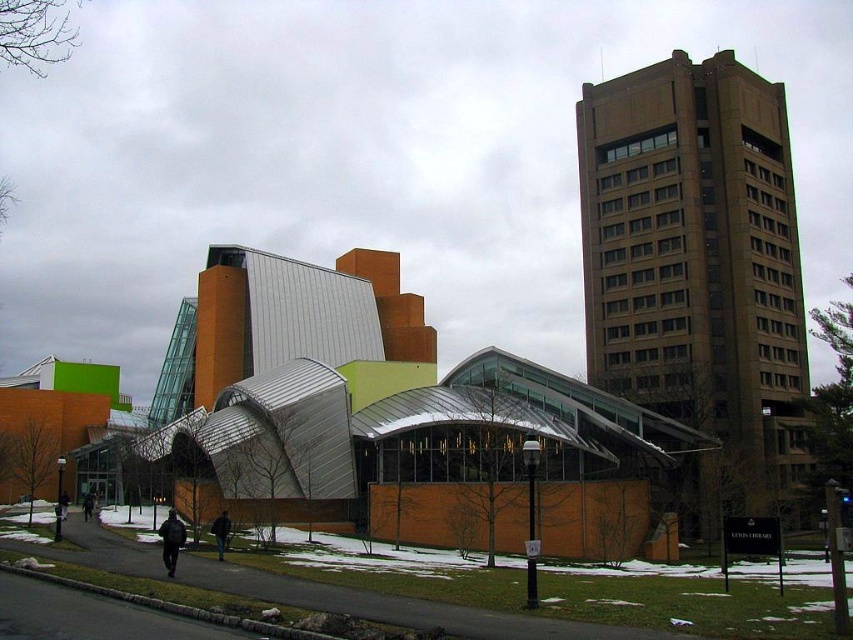
You are organizing a charity event and need to arrange two jackets for a photo shoot. The jackets are the dark blue jacket at center and the dark gray jacket at lower left. Which jacket should you place in a smaller display area to fit properly?

The dark blue jacket at center occupies less space than the dark gray jacket at lower left, so it should be placed in the smaller display area to fit properly.

You are standing in the modern architectural complex and see two jackets. The dark blue jacket at center and the dark gray jacket at lower left. Which jacket is positioned more to the right?

The dark gray jacket at lower left is positioned more to the right than the dark blue jacket at center.